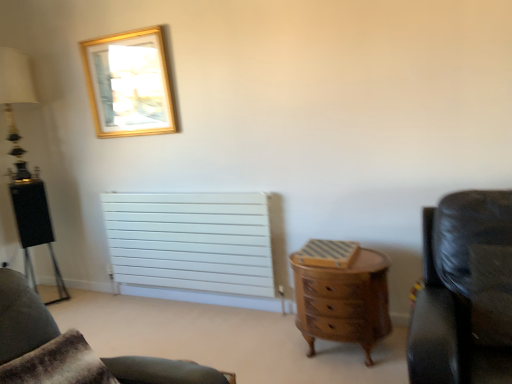
Question: Based on their sizes in the image, would you say gold metallic picture frame at upper left is bigger or smaller than wooden chest of drawers at center?

Choices:
 (A) big
 (B) small

Answer: (B)

Question: Considering the positions of gold metallic picture frame at upper left and wooden chest of drawers at center in the image, is gold metallic picture frame at upper left wider or thinner than wooden chest of drawers at center?

Choices:
 (A) wide
 (B) thin

Answer: (B)

Question: Which object is the farthest from the black leather chair at right, which appears as the 1th chair when viewed from the right?

Choices:
 (A) wooden chest of drawers at center
 (B) white matte radiator at center
 (C) gold metallic picture frame at upper left
 (D) brown fur pillow at lower left
 (E) leather couch at lower right, which is the 1th chair from left to right

Answer: (C)

Question: Considering the real-world distances, which object is closest to the white matte radiator at center?

Choices:
 (A) wooden chest of drawers at center
 (B) brown fur pillow at lower left
 (C) leather couch at lower right, which is the 1th chair from left to right
 (D) gold metallic picture frame at upper left
 (E) black leather chair at right, the 2th chair viewed from the left

Answer: (D)